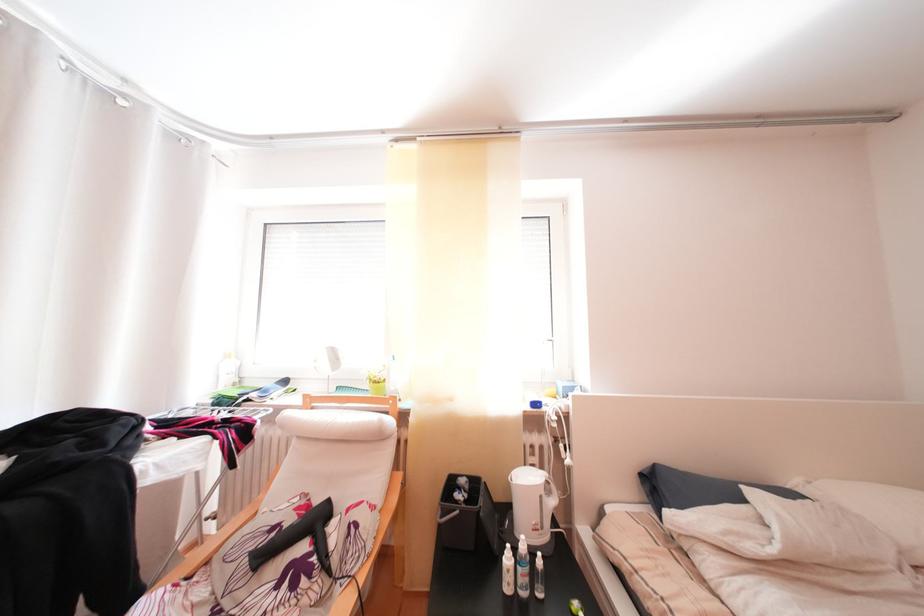
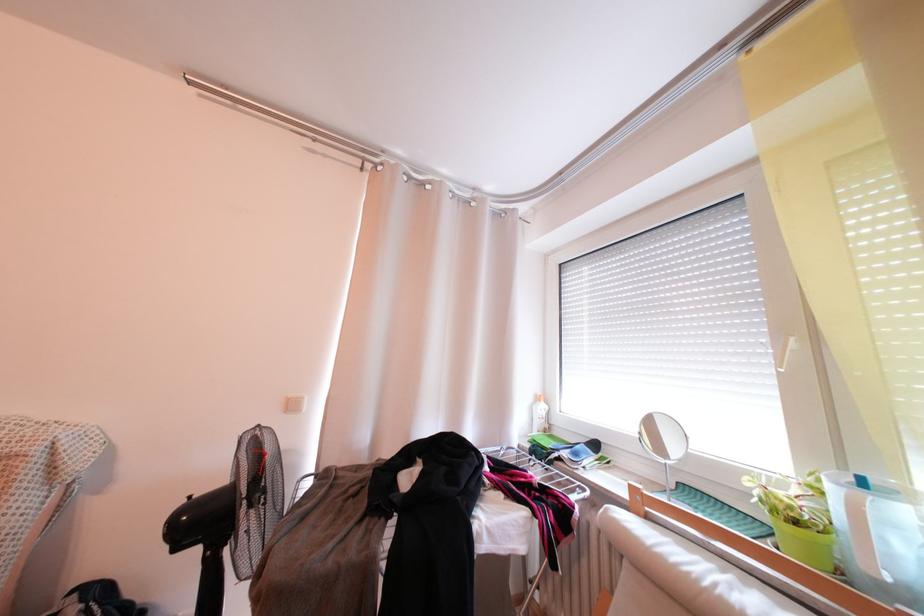
Question: The images are taken continuously from a first-person perspective. In which direction is your viewpoint rotating?

Choices:
 (A) Left
 (B) Right
 (C) Up
 (D) Down

Answer: (A)